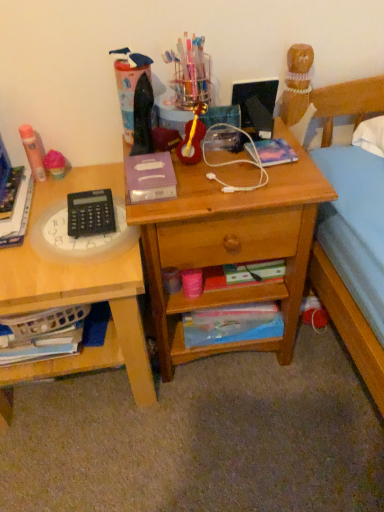
Identify the location of vacant space to the right of pink fluffy ball at left, which is the second stationery from left to right. (92, 172).